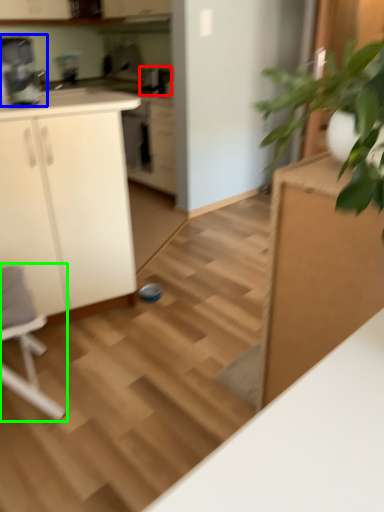
Question: Which is nearer to the appliance (highlighted by a red box)? coffee machine (highlighted by a blue box) or rocking chair (highlighted by a green box).

Choices:
 (A) coffee machine
 (B) rocking chair

Answer: (A)